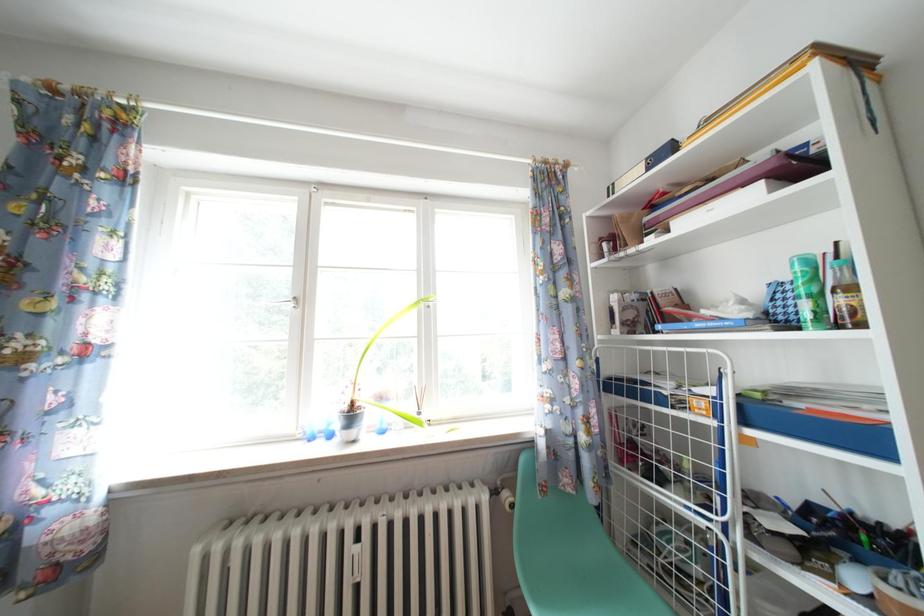
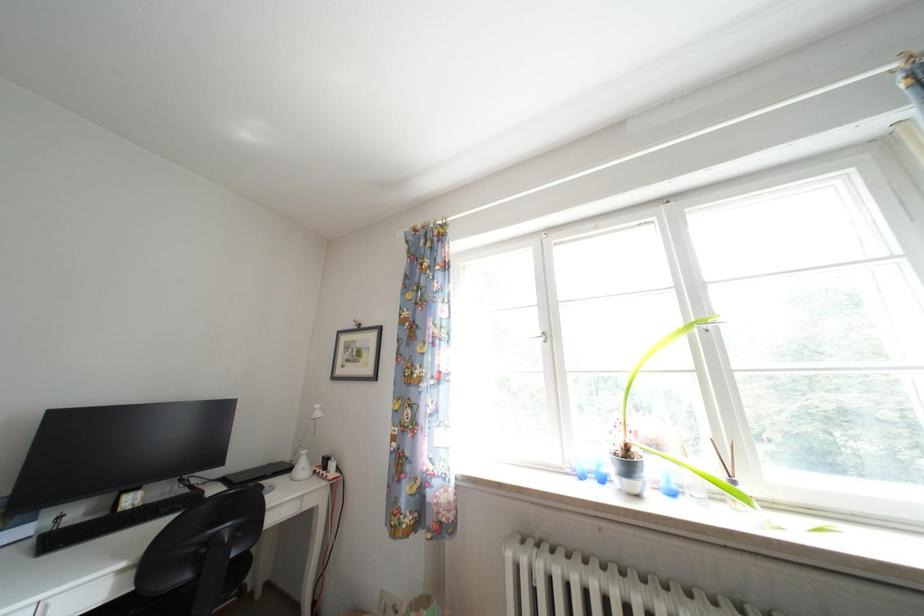
Question: The images are taken continuously from a first-person perspective. In which direction is your viewpoint rotating?

Choices:
 (A) Left
 (B) Right
 (C) Up
 (D) Down

Answer: (A)